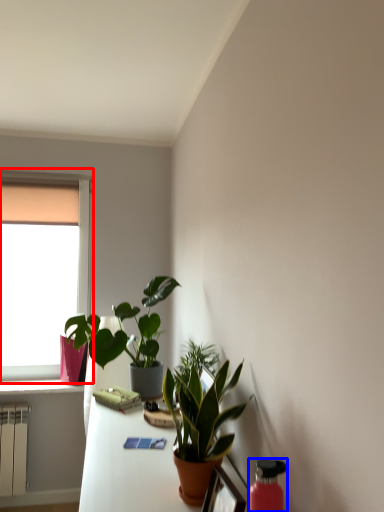
Question: Which object appears farthest to the camera in this image, window (highlighted by a red box) or bottle (highlighted by a blue box)?

Choices:
 (A) window
 (B) bottle

Answer: (A)